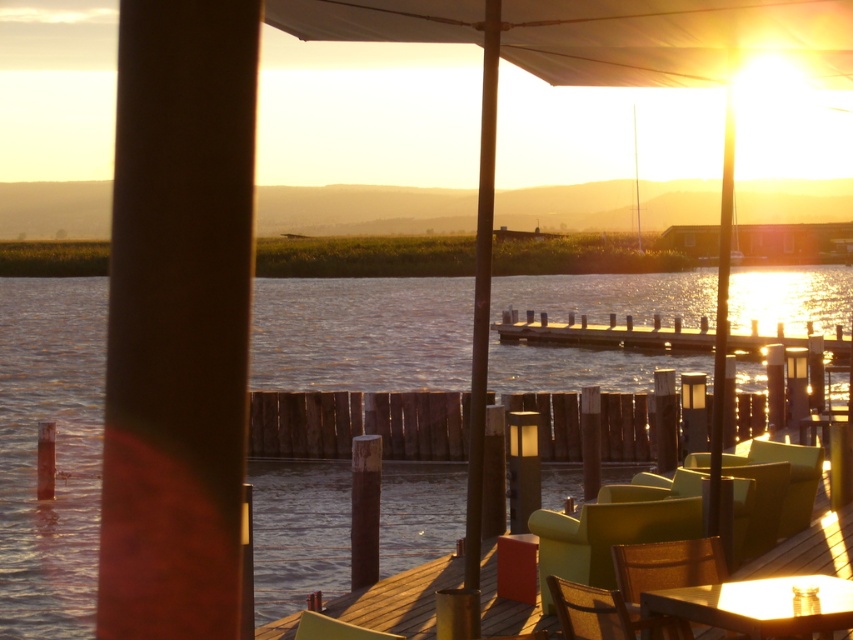
What do you see at coordinates (759, 605) in the screenshot? I see `matte wooden table at lower right` at bounding box center [759, 605].

Is matte wooden table at lower right wider than matte green chair at lower center?

Correct, the width of matte wooden table at lower right exceeds that of matte green chair at lower center.

I want to click on matte wooden table at lower right, so click(x=759, y=605).

Find the location of a particular element. This screenshot has height=640, width=853. matte wooden table at lower right is located at coordinates (759, 605).

Between matte wooden table at lower right and wooden textured chair at lower right, which one has less height?

matte wooden table at lower right is shorter.

Does matte wooden table at lower right appear on the right side of wooden textured chair at lower right?

Indeed, matte wooden table at lower right is positioned on the right side of wooden textured chair at lower right.

Does point (827, 595) come closer to viewer compared to point (581, 612)?

Yes.

Locate an element on the screen. Image resolution: width=853 pixels, height=640 pixels. matte wooden table at lower right is located at coordinates (759, 605).

Can you confirm if shiny blue water at center is positioned to the right of matte green chair at lower right?

In fact, shiny blue water at center is to the left of matte green chair at lower right.

Can you confirm if shiny blue water at center is bigger than matte green chair at lower right?

Yes.

What do you see at coordinates (55, 451) in the screenshot? I see `shiny blue water at center` at bounding box center [55, 451].

I want to click on shiny blue water at center, so click(55, 451).